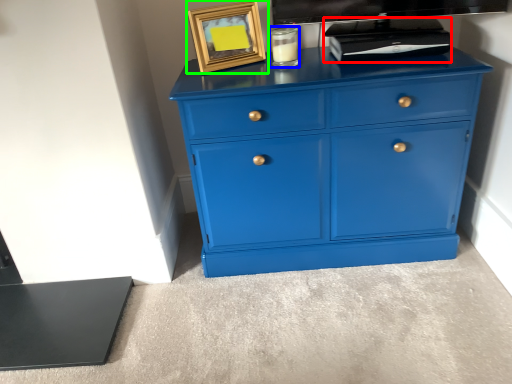
Question: Which object is positioned farthest from appliance (highlighted by a red box)? Select from candle holder (highlighted by a blue box) and picture frame (highlighted by a green box).

Choices:
 (A) candle holder
 (B) picture frame

Answer: (B)